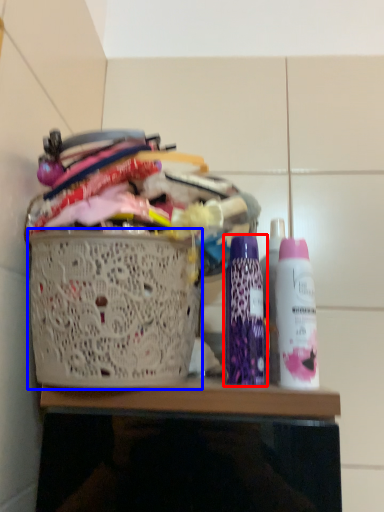
Question: Which point is closer to the camera, bottle (highlighted by a red box) or basket (highlighted by a blue box)?

Choices:
 (A) bottle
 (B) basket

Answer: (B)